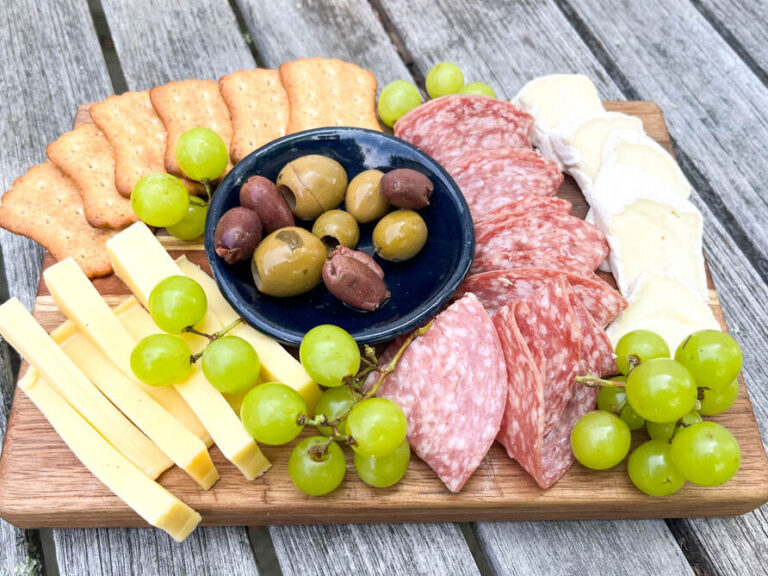
Image resolution: width=768 pixels, height=576 pixels. I want to click on area above wooden board, so click(x=398, y=37).